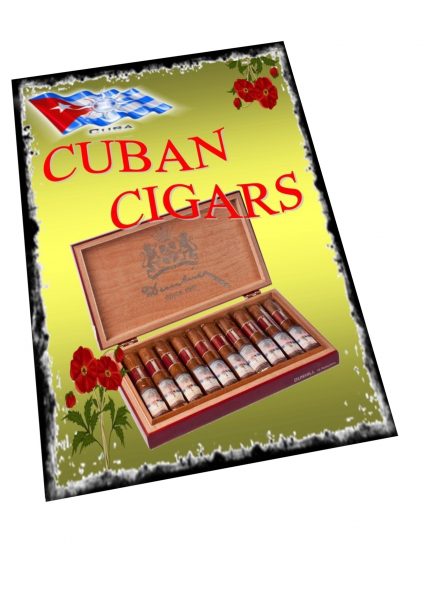
You are a GUI agent. You are given a task and a screenshot of the screen. Output one action in this format:
    pyautogui.click(x=<x>, y=<y>)
    Task: Click on the place where cigars are placed
    The height and width of the screenshot is (600, 424).
    Given the screenshot: What is the action you would take?
    tap(199, 371)